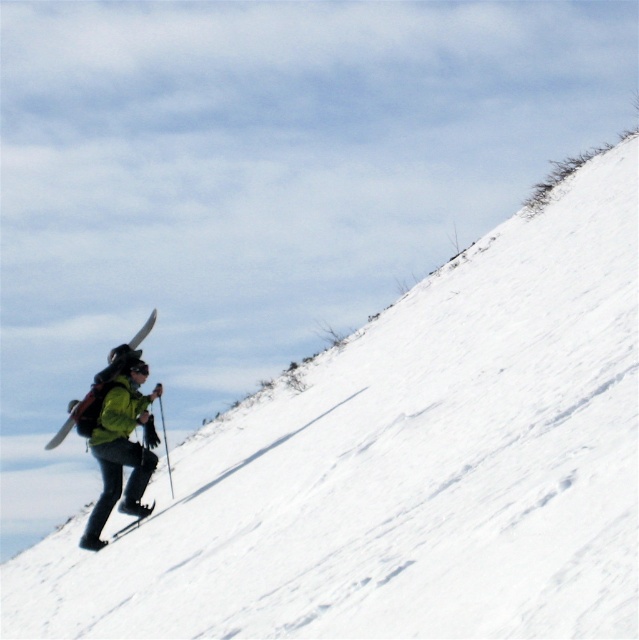
In the scene shown: Which of these two, green fabric jacket at lower left or matte black ski at lower left, stands taller?

With more height is green fabric jacket at lower left.

Between point (88, 400) and point (121, 513), which one is positioned in front?

Point (88, 400) is in front.

The height and width of the screenshot is (640, 639). Identify the location of green fabric jacket at lower left. (116, 436).

Does matte white ski at upper left appear under matte black ski at lower left?

No, matte white ski at upper left is not below matte black ski at lower left.

Is matte white ski at upper left wider than matte black ski at lower left?

Yes.

Is point (142, 326) closer to viewer compared to point (141, 506)?

No, (142, 326) is further to viewer.

Identify the location of matte white ski at upper left. (142, 330).

Is green fabric jacket at lower left wider than matte white ski at upper left?

No, green fabric jacket at lower left is not wider than matte white ski at upper left.

Consider the image. Does green fabric jacket at lower left have a lesser height compared to matte white ski at upper left?

Correct, green fabric jacket at lower left is not as tall as matte white ski at upper left.

You are a GUI agent. You are given a task and a screenshot of the screen. Output one action in this format:
    pyautogui.click(x=<x>, y=<y>)
    Task: Click on the green fabric jacket at lower left
    
    Given the screenshot: What is the action you would take?
    pyautogui.click(x=116, y=436)